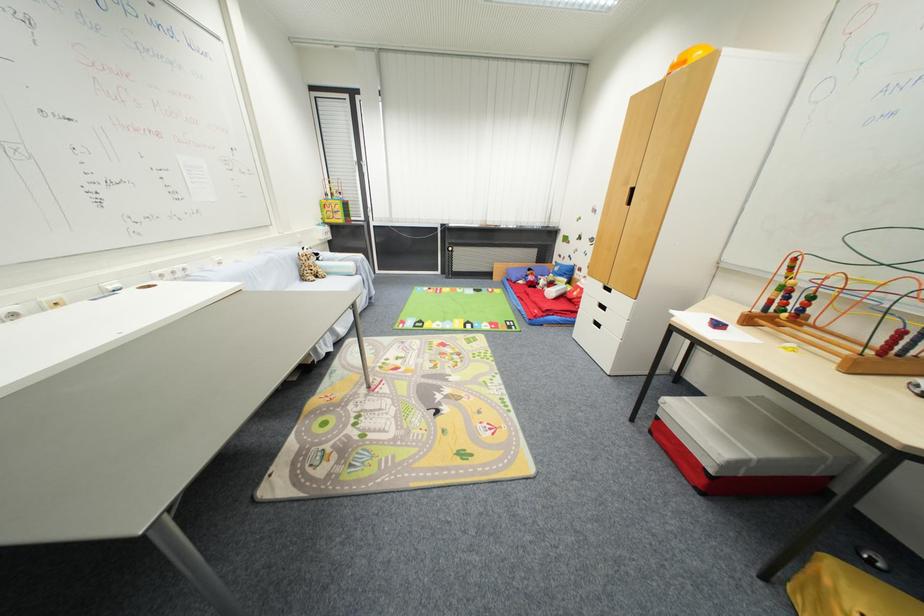
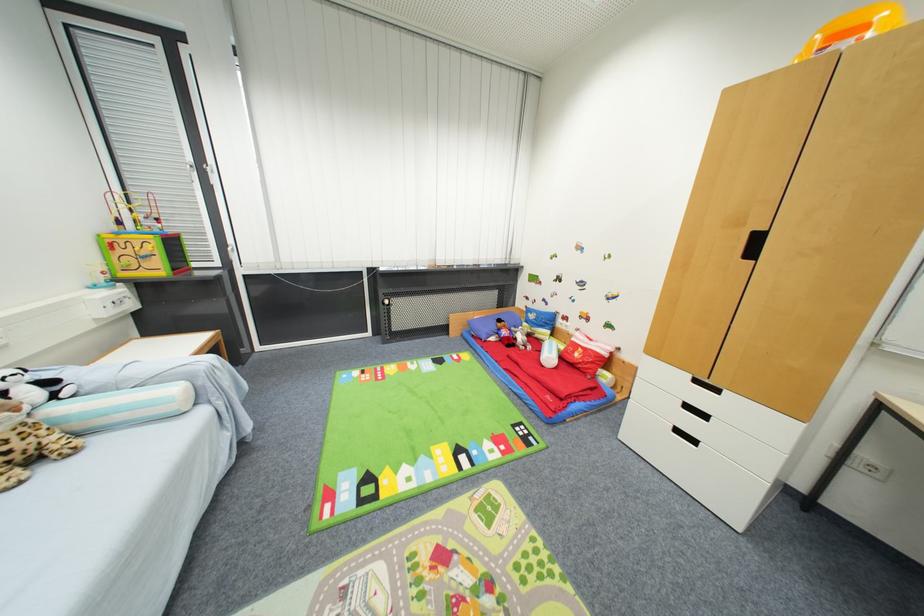
The point at (688, 63) is marked in the first image. Where is the corresponding point in the second image?

(868, 30)